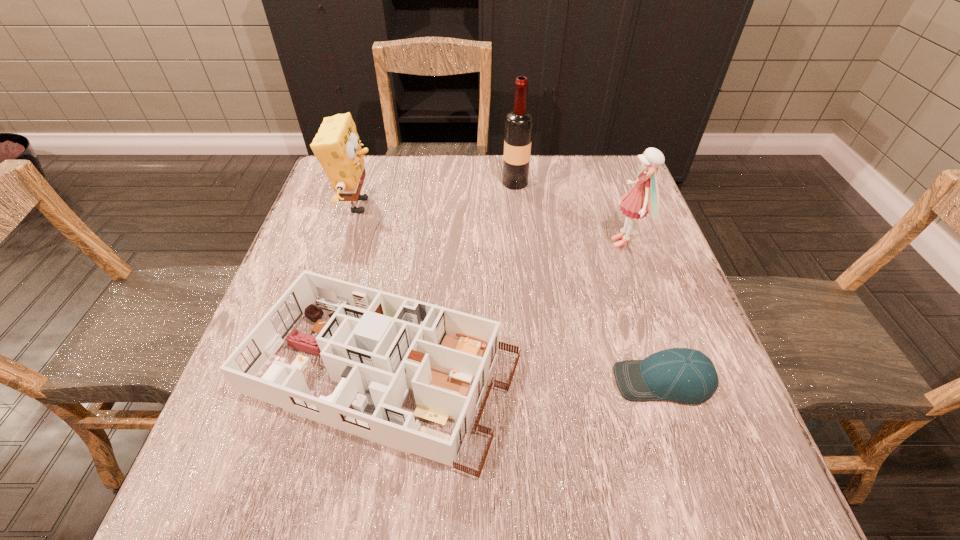
Image resolution: width=960 pixels, height=540 pixels. I want to click on vacant space located 0.110m on the right of the dollhouse, so click(x=581, y=375).

You are a GUI agent. You are given a task and a screenshot of the screen. Output one action in this format:
    pyautogui.click(x=<x>, y=<y>)
    Task: Click on the vacant space located on the back of the baseball cap
    The height and width of the screenshot is (540, 960).
    Given the screenshot: What is the action you would take?
    pyautogui.click(x=616, y=237)

Locate an element on the screen. Image resolution: width=960 pixels, height=540 pixels. wine bottle located in the far edge section of the desktop is located at coordinates (519, 123).

In order to click on sponge that is at the far edge in this screenshot , I will do `click(336, 146)`.

Locate an element on the screen. This screenshot has height=540, width=960. object positioned at the near edge is located at coordinates (377, 345).

Where is `sponge positioned at the left edge`? The height and width of the screenshot is (540, 960). sponge positioned at the left edge is located at coordinates (336, 146).

Locate an element on the screen. This screenshot has width=960, height=540. dollhouse situated at the left edge is located at coordinates (377, 345).

At what (x,y) coordinates should I click in order to perform the action: click on doll located in the right edge section of the desktop. Please return your answer as a coordinate pair (x, y). This screenshot has height=540, width=960. Looking at the image, I should click on (644, 196).

In order to click on baseball cap present at the right edge in this screenshot , I will do 684,375.

I want to click on object present at the far left corner, so click(336, 146).